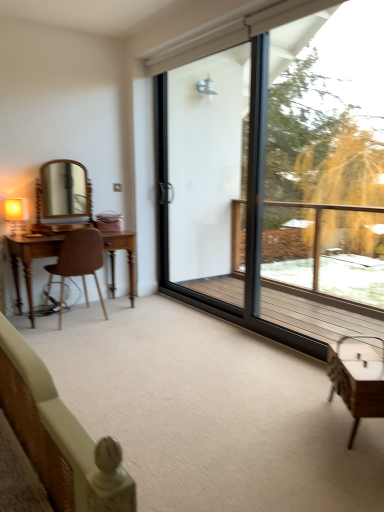
Where is `free space in front of wooden desk at left, the first table in the back-to-front sequence`? This screenshot has height=512, width=384. free space in front of wooden desk at left, the first table in the back-to-front sequence is located at coordinates (86, 337).